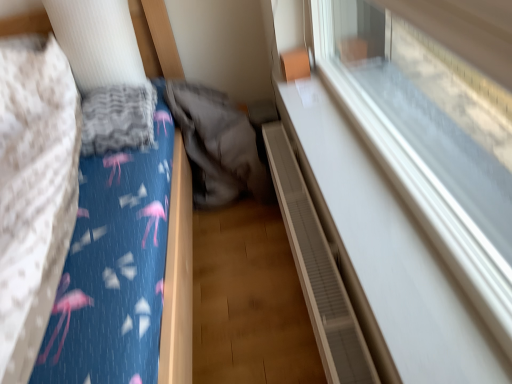
Measure the distance between point (x=415, y=100) and camera.

The distance of point (x=415, y=100) from camera is 4.98 feet.

Locate an element on the screen. This screenshot has width=512, height=384. transparent glass window at upper right is located at coordinates (430, 135).

Which object is further away from the camera taking this photo, blue cotton sheet at left or blue fabric bed at left?

blue cotton sheet at left.

This screenshot has width=512, height=384. Find the location of `sheet located behind the blue fabric bed at left`. sheet located behind the blue fabric bed at left is located at coordinates (34, 195).

Which point is more distant from viewer, (19, 159) or (170, 64)?

The point (170, 64) is more distant.

In the scene shown: Considering the positions of objects blue cotton sheet at left and blue fabric bed at left in the image provided, who is more to the right, blue cotton sheet at left or blue fabric bed at left?

blue cotton sheet at left is more to the right.

Is brown textured radiator at lower right oriented towards blue cotton sheet at left?

No, brown textured radiator at lower right is not facing towards blue cotton sheet at left.

Can you tell me how much brown textured radiator at lower right and blue cotton sheet at left differ in facing direction?

brown textured radiator at lower right and blue cotton sheet at left are facing 91.3 degrees away from each other.

Between brown textured radiator at lower right and blue cotton sheet at left, which one has more height?

Standing taller between the two is blue cotton sheet at left.

Considering the sizes of brown textured radiator at lower right and blue cotton sheet at left in the image, is brown textured radiator at lower right wider or thinner than blue cotton sheet at left?

Clearly, brown textured radiator at lower right has less width compared to blue cotton sheet at left.

Consider the image. Who is smaller, blue cotton sheet at left or gray fabric sleeping bag at center?

gray fabric sleeping bag at center.

In the scene shown: Considering their positions, is blue cotton sheet at left located in front of or behind gray fabric sleeping bag at center?

blue cotton sheet at left is in front of gray fabric sleeping bag at center.

In the image, is blue fabric bed at left positioned in front of or behind gray fabric sleeping bag at center?

blue fabric bed at left is positioned closer to the viewer than gray fabric sleeping bag at center.

In terms of size, does blue fabric bed at left appear bigger or smaller than gray fabric sleeping bag at center?

Considering their sizes, blue fabric bed at left takes up more space than gray fabric sleeping bag at center.

Would you say blue fabric bed at left is to the left or to the right of gray fabric sleeping bag at center in the picture?

In the image, blue fabric bed at left appears on the left side of gray fabric sleeping bag at center.

Between blue fabric bed at left and gray fabric sleeping bag at center, which one has smaller width?

With smaller width is gray fabric sleeping bag at center.

How many degrees apart are the facing directions of gray fabric sleeping bag at center and blue fabric bed at left?

1.61 degrees separate the facing orientations of gray fabric sleeping bag at center and blue fabric bed at left.

Which of these two, gray fabric sleeping bag at center or blue fabric bed at left, stands taller?

Standing taller between the two is blue fabric bed at left.

Considering the positions of objects gray fabric sleeping bag at center and blue fabric bed at left in the image provided, who is behind, gray fabric sleeping bag at center or blue fabric bed at left?

gray fabric sleeping bag at center is further from the camera.

Consider the image. How distant is gray fabric sleeping bag at center from brown textured radiator at lower right?

A distance of 14.73 inches exists between gray fabric sleeping bag at center and brown textured radiator at lower right.

Considering the sizes of gray fabric sleeping bag at center and brown textured radiator at lower right in the image, is gray fabric sleeping bag at center taller or shorter than brown textured radiator at lower right?

Considering their sizes, gray fabric sleeping bag at center has more height than brown textured radiator at lower right.

Does gray fabric sleeping bag at center turn towards brown textured radiator at lower right?

Yes, gray fabric sleeping bag at center is aimed at brown textured radiator at lower right.

Is point (205, 138) closer to viewer compared to point (329, 302)?

No, it is not.

In the image, is blue fabric bed at left on the left side or the right side of transparent glass window at upper right?

Clearly, blue fabric bed at left is on the left of transparent glass window at upper right in the image.

Based on their sizes in the image, would you say blue fabric bed at left is bigger or smaller than transparent glass window at upper right?

Considering their sizes, blue fabric bed at left takes up more space than transparent glass window at upper right.

From the picture: How many degrees apart are the facing directions of blue fabric bed at left and transparent glass window at upper right?

The angle between the facing direction of blue fabric bed at left and the facing direction of transparent glass window at upper right is 90.2 degrees.

Identify the location of sheet that appears above the blue fabric bed at left (from the image's perspective). (34, 195).

Where is `balustrade on the right side of blue cotton sheet at left`? This screenshot has height=384, width=512. balustrade on the right side of blue cotton sheet at left is located at coordinates (317, 269).

Based on their spatial positions, is blue fabric bed at left or blue cotton sheet at left closer to brown textured radiator at lower right?

blue fabric bed at left is positioned closer to the anchor brown textured radiator at lower right.

Based on their spatial positions, is gray fabric sleeping bag at center or brown textured radiator at lower right further from blue cotton sheet at left?

brown textured radiator at lower right lies further to blue cotton sheet at left than the other object.

Considering their positions, is gray fabric sleeping bag at center positioned closer to blue cotton sheet at left than blue fabric bed at left?

Among the two, blue fabric bed at left is located nearer to blue cotton sheet at left.

Based on their spatial positions, is transparent glass window at upper right or blue fabric bed at left further from brown textured radiator at lower right?

Among the two, transparent glass window at upper right is located further to brown textured radiator at lower right.

Estimate the real-world distances between objects in this image. Which object is further from blue fabric bed at left, blue cotton sheet at left or gray fabric sleeping bag at center?

blue cotton sheet at left is positioned further to the anchor blue fabric bed at left.

Considering their positions, is gray fabric sleeping bag at center positioned closer to brown textured radiator at lower right than transparent glass window at upper right?

gray fabric sleeping bag at center is closer to brown textured radiator at lower right.

Looking at this image, when comparing their distances from gray fabric sleeping bag at center, does blue cotton sheet at left or blue fabric bed at left seem closer?

Based on the image, blue fabric bed at left appears to be nearer to gray fabric sleeping bag at center.

From the image, which object appears to be nearer to brown textured radiator at lower right, transparent glass window at upper right or gray fabric sleeping bag at center?

The object closer to brown textured radiator at lower right is gray fabric sleeping bag at center.

In order to click on sheet between transparent glass window at upper right and gray fabric sleeping bag at center along the z-axis in this screenshot , I will do `click(34, 195)`.

Find the location of a particular element. sleeping bag between blue cotton sheet at left and brown textured radiator at lower right in the horizontal direction is located at coordinates (217, 145).

At what (x,y) coordinates should I click in order to perform the action: click on furniture located between transparent glass window at upper right and gray fabric sleeping bag at center in the depth direction. Please return your answer as a coordinate pair (x, y). This screenshot has height=384, width=512. Looking at the image, I should click on (179, 281).

Where is `sheet between blue fabric bed at left and transparent glass window at upper right from left to right`? Image resolution: width=512 pixels, height=384 pixels. sheet between blue fabric bed at left and transparent glass window at upper right from left to right is located at coordinates (34, 195).